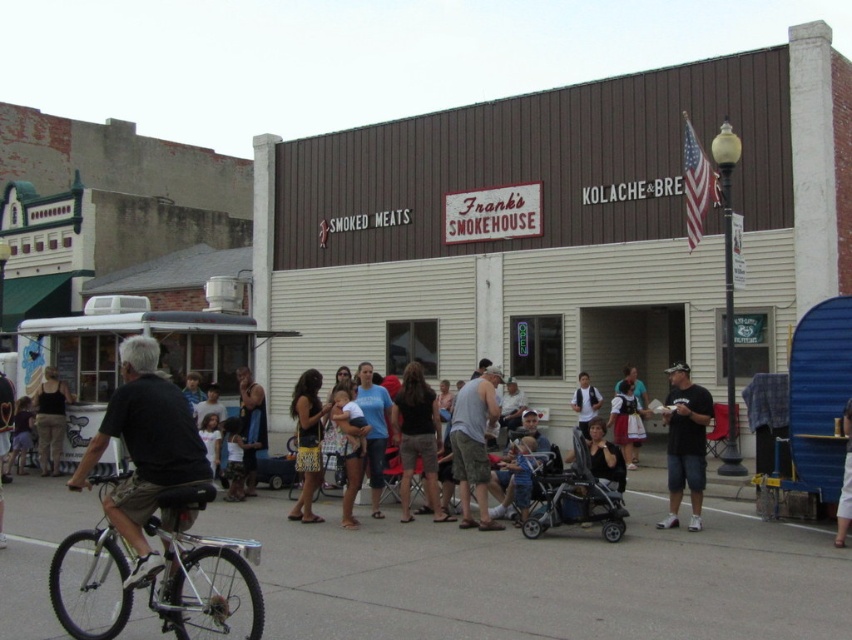
Question: Estimate the real-world distances between objects in this image. Which object is closer to the silver metallic bicycle at lower left?

Choices:
 (A) dark brown shorts at center
 (B) denim pants at center
 (C) dark blue jeans at center

Answer: (A)

Question: Which point appears farthest from the camera in this image?

Choices:
 (A) pyautogui.click(x=317, y=426)
 (B) pyautogui.click(x=260, y=413)

Answer: (B)

Question: Observing the image, what is the correct spatial positioning of silver metallic stroller at center in reference to matte black tank top at lower left?

Choices:
 (A) right
 (B) left

Answer: (A)

Question: Which object appears farthest from the camera in this image?

Choices:
 (A) dark brown shorts at center
 (B) camouflage shorts at center
 (C) light brown leather jacket at lower left

Answer: (A)

Question: Is black cotton shirt at lower right to the right of light brown leather jacket at lower left from the viewer's perspective?

Choices:
 (A) no
 (B) yes

Answer: (B)

Question: Is camouflage shorts at center bigger than light brown leather jacket at lower left?

Choices:
 (A) no
 (B) yes

Answer: (B)